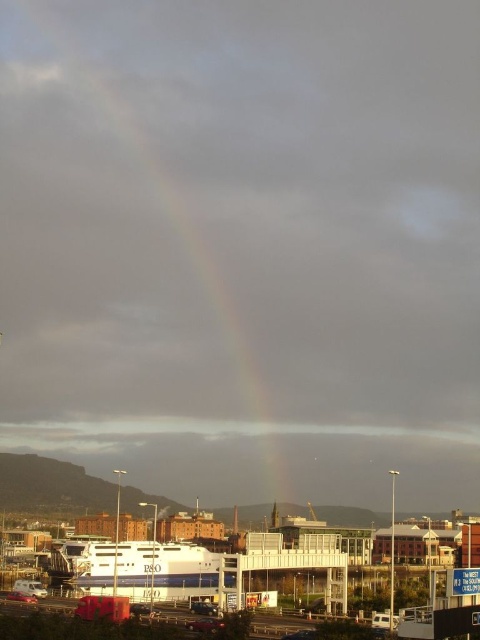
Question: Is rainbow at center positioned in front of white glossy ferry at center?

Choices:
 (A) no
 (B) yes

Answer: (A)

Question: Does rainbow at center have a smaller size compared to white glossy ferry at center?

Choices:
 (A) yes
 (B) no

Answer: (B)

Question: In this image, where is rainbow at center located relative to white glossy ferry at center?

Choices:
 (A) left
 (B) right

Answer: (A)